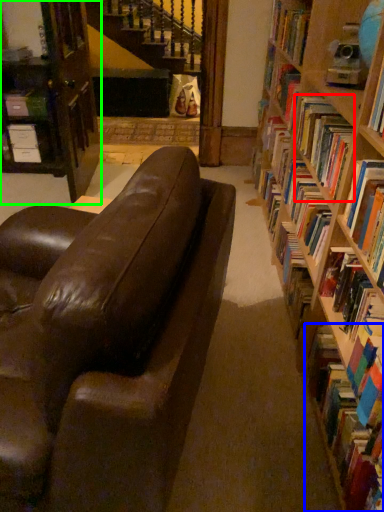
Question: Which is nearer to the book (highlighted by a red box)? book (highlighted by a blue box) or bookcase (highlighted by a green box).

Choices:
 (A) book
 (B) bookcase

Answer: (A)